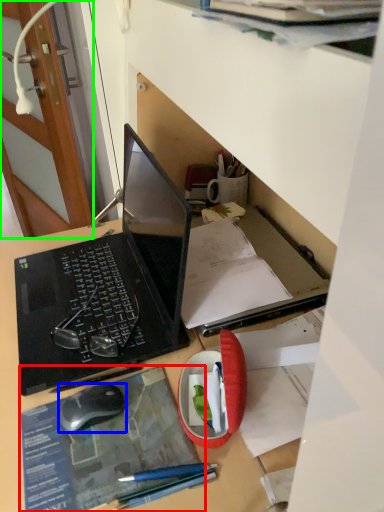
Question: Based on their relative distances, which object is farther from paperback book (highlighted by a red box)? Choose from computer mouse (highlighted by a blue box) and door (highlighted by a green box).

Choices:
 (A) computer mouse
 (B) door

Answer: (B)